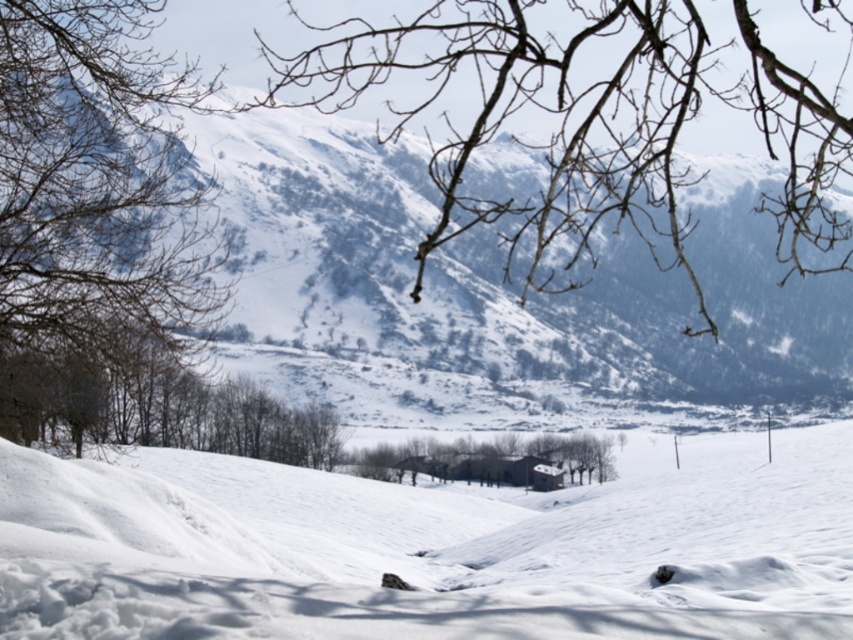
Question: Among these objects, which one is farthest from the camera?

Choices:
 (A) snowy white mountain at upper center
 (B) bare branches at left
 (C) bare branches at upper center

Answer: (A)

Question: Is snowy white mountain at upper center behind bare branches at upper center?

Choices:
 (A) no
 (B) yes

Answer: (B)

Question: Does snowy white mountain at upper center lie in front of bare branches at upper center?

Choices:
 (A) no
 (B) yes

Answer: (A)

Question: From the image, what is the correct spatial relationship of bare branches at upper center in relation to brown wood house at center?

Choices:
 (A) above
 (B) below

Answer: (A)

Question: Which of the following is the farthest from the observer?

Choices:
 (A) white snow at center
 (B) snowy white mountain at upper center
 (C) bare branches at left
 (D) brown wood house at center

Answer: (D)

Question: Estimate the real-world distances between objects in this image. Which object is closer to the bare branches at left?

Choices:
 (A) brown wood house at center
 (B) white snow at center
 (C) bare branches at upper center
 (D) snowy white mountain at upper center

Answer: (B)